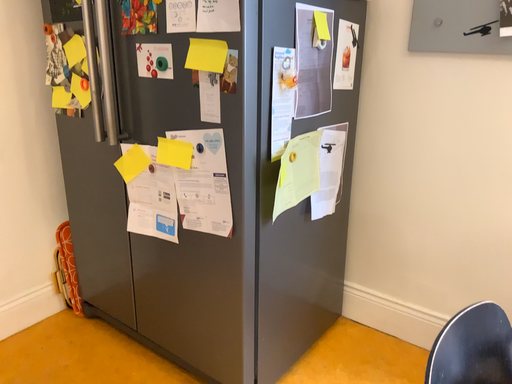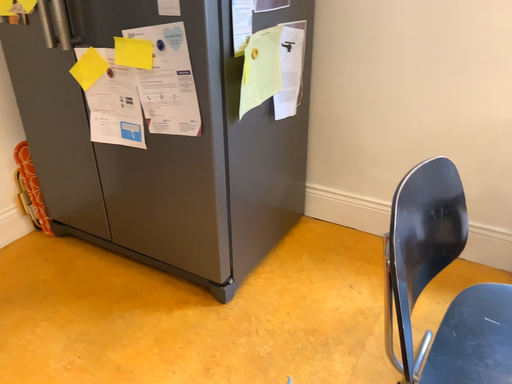
Question: How did the camera likely rotate when shooting the video?

Choices:
 (A) rotated upward
 (B) rotated downward

Answer: (B)